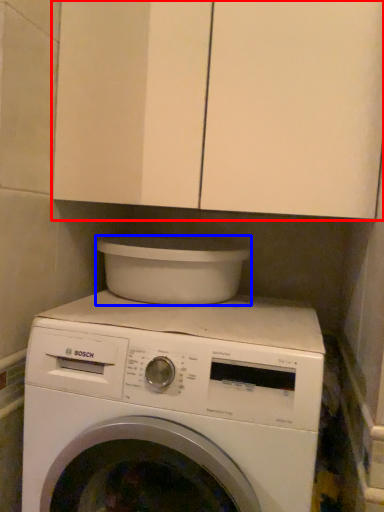
Question: Which point is further to the camera, cabinetry (highlighted by a red box) or appliance (highlighted by a blue box)?

Choices:
 (A) cabinetry
 (B) appliance

Answer: (B)